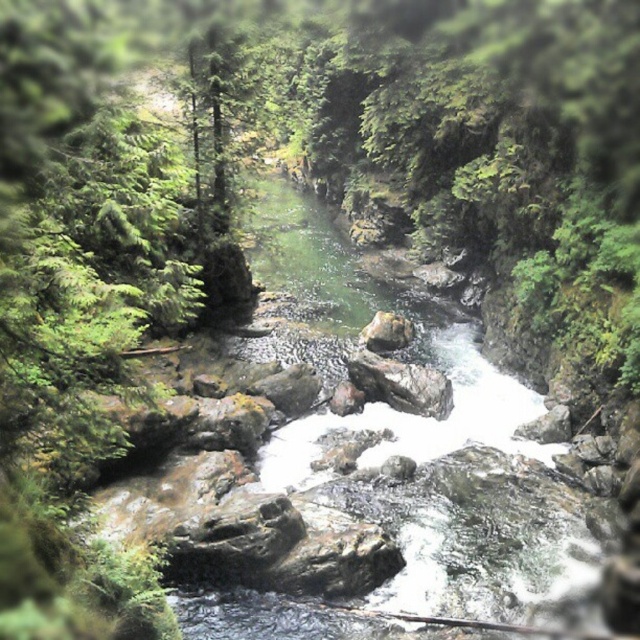
Question: Which of the following is the closest to the observer?

Choices:
 (A) (396, 333)
 (B) (403, 397)

Answer: (B)

Question: Which point is farther to the camera?

Choices:
 (A) smooth gray rock at center
 (B) rough textured rock at center

Answer: (A)

Question: Does rough textured rock at center have a greater width compared to smooth gray rock at center?

Choices:
 (A) no
 (B) yes

Answer: (B)

Question: Where is rough textured rock at center located in relation to smooth gray rock at center in the image?

Choices:
 (A) right
 (B) left

Answer: (B)

Question: Does rough textured rock at center appear over smooth gray rock at center?

Choices:
 (A) no
 (B) yes

Answer: (A)